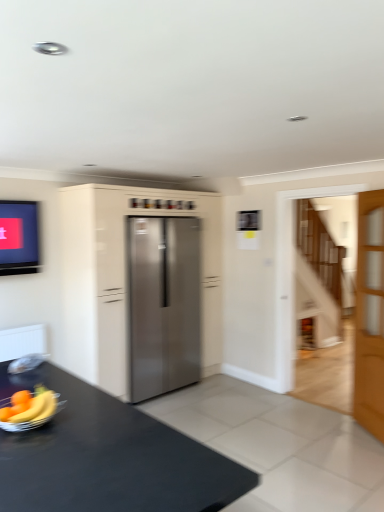
What do you see at coordinates (108, 458) in the screenshot? Image resolution: width=384 pixels, height=512 pixels. I see `black matte table at lower left` at bounding box center [108, 458].

What do you see at coordinates (163, 304) in the screenshot?
I see `stainless steel refrigerator at center` at bounding box center [163, 304].

Find the location of a particular element. stainless steel refrigerator at center is located at coordinates (124, 277).

Considering the sizes of light brown wooden door at right and yellow matte banana at lower left in the image, is light brown wooden door at right wider or thinner than yellow matte banana at lower left?

In the image, light brown wooden door at right appears to be more narrow than yellow matte banana at lower left.

Is light brown wooden door at right closer to the viewer compared to yellow matte banana at lower left?

No, it is not.

The height and width of the screenshot is (512, 384). I want to click on banana on the left of the light brown wooden door at right, so click(34, 413).

Considering the sizes of objects stainless steel refrigerator at center and yellow matte banana at lower left in the image provided, who is taller, stainless steel refrigerator at center or yellow matte banana at lower left?

stainless steel refrigerator at center is taller.

Does stainless steel refrigerator at center have a lesser width compared to yellow matte banana at lower left?

In fact, stainless steel refrigerator at center might be wider than yellow matte banana at lower left.

Does stainless steel refrigerator at center come behind yellow matte banana at lower left?

Yes, the depth of stainless steel refrigerator at center is greater than that of yellow matte banana at lower left.

Is point (213, 311) farther from camera compared to point (55, 406)?

Yes, point (213, 311) is behind point (55, 406).

Between black matte table at lower left and light brown wooden door at right, which one has smaller width?

light brown wooden door at right is thinner.

Which object is closer to the camera taking this photo, black matte table at lower left or light brown wooden door at right?

black matte table at lower left.

From a real-world perspective, is black matte table at lower left physically located above or below light brown wooden door at right?

black matte table at lower left is below light brown wooden door at right.

Considering the positions of points (43, 411) and (375, 270), is point (43, 411) closer to camera compared to point (375, 270)?

Yes, it is in front of point (375, 270).

Is yellow matte banana at lower left looking in the opposite direction of light brown wooden door at right?

Yes.

Consider the image. Which object is further away from the camera, yellow matte banana at lower left or light brown wooden door at right?

light brown wooden door at right is behind.

I want to click on door behind the yellow matte banana at lower left, so click(370, 315).

Does stainless steel refrigerator at center come in front of stainless steel refrigerator at center?

No, stainless steel refrigerator at center is behind stainless steel refrigerator at center.

Which is more to the left, stainless steel refrigerator at center or stainless steel refrigerator at center?

stainless steel refrigerator at center.

Is stainless steel refrigerator at center to the left of black matte table at lower left from the viewer's perspective?

No.

From the image's perspective, does stainless steel refrigerator at center appear higher than black matte table at lower left?

Yes.

Would you say black matte table at lower left is part of stainless steel refrigerator at center's contents?

Definitely not — black matte table at lower left is not inside stainless steel refrigerator at center.

Based on the photo, from a real-world perspective, between stainless steel refrigerator at center and black matte table at lower left, who is vertically higher?

stainless steel refrigerator at center.

Between point (356, 292) and point (73, 447), which one is positioned behind?

The point (356, 292) is more distant.

From a real-world perspective, is light brown wooden door at right over black matte table at lower left?

Yes.

Could you tell me if light brown wooden door at right is facing black matte table at lower left?

No, light brown wooden door at right is not oriented towards black matte table at lower left.

Can you confirm if light brown wooden door at right is shorter than black matte table at lower left?

No, light brown wooden door at right is not shorter than black matte table at lower left.

The width and height of the screenshot is (384, 512). Find the location of `banana that appears below the light brown wooden door at right (from the image's perspective)`. banana that appears below the light brown wooden door at right (from the image's perspective) is located at coordinates (34, 413).

The height and width of the screenshot is (512, 384). In order to click on cabinetry lying on the right of yellow matte banana at lower left in this screenshot , I will do `click(124, 277)`.

Estimate the real-world distances between objects in this image. Which object is further from stainless steel refrigerator at center, black matte table at lower left or yellow matte banana at lower left?

yellow matte banana at lower left is positioned further to the anchor stainless steel refrigerator at center.

From the picture: Looking at the image, which one is located closer to yellow matte banana at lower left, stainless steel refrigerator at center or black matte table at lower left?

Based on the image, black matte table at lower left appears to be nearer to yellow matte banana at lower left.

Estimate the real-world distances between objects in this image. Which object is closer to yellow matte banana at lower left, light brown wooden door at right or stainless steel refrigerator at center?

Among the two, stainless steel refrigerator at center is located nearer to yellow matte banana at lower left.

Consider the image. Estimate the real-world distances between objects in this image. Which object is further from stainless steel refrigerator at center, stainless steel refrigerator at center or light brown wooden door at right?

light brown wooden door at right is positioned further to the anchor stainless steel refrigerator at center.

Based on their spatial positions, is yellow matte banana at lower left or light brown wooden door at right closer to stainless steel refrigerator at center?

light brown wooden door at right.

Estimate the real-world distances between objects in this image. Which object is closer to stainless steel refrigerator at center, stainless steel refrigerator at center or yellow matte banana at lower left?

stainless steel refrigerator at center is positioned closer to the anchor stainless steel refrigerator at center.

Looking at this image, considering their positions, is stainless steel refrigerator at center positioned further to light brown wooden door at right than stainless steel refrigerator at center?

stainless steel refrigerator at center is positioned further to the anchor light brown wooden door at right.

Considering their positions, is black matte table at lower left positioned further to stainless steel refrigerator at center than yellow matte banana at lower left?

yellow matte banana at lower left is positioned further to the anchor stainless steel refrigerator at center.

I want to click on cabinetry between yellow matte banana at lower left and light brown wooden door at right, so click(x=124, y=277).

Where is `banana between black matte table at lower left and stainless steel refrigerator at center from front to back`? The image size is (384, 512). banana between black matte table at lower left and stainless steel refrigerator at center from front to back is located at coordinates (34, 413).

You are a GUI agent. You are given a task and a screenshot of the screen. Output one action in this format:
    pyautogui.click(x=<x>, y=<y>)
    Task: Click on the door positioned between black matte table at lower left and stainless steel refrigerator at center from near to far
    
    Given the screenshot: What is the action you would take?
    pyautogui.click(x=370, y=315)

The image size is (384, 512). I want to click on cabinetry between black matte table at lower left and stainless steel refrigerator at center from front to back, so click(124, 277).